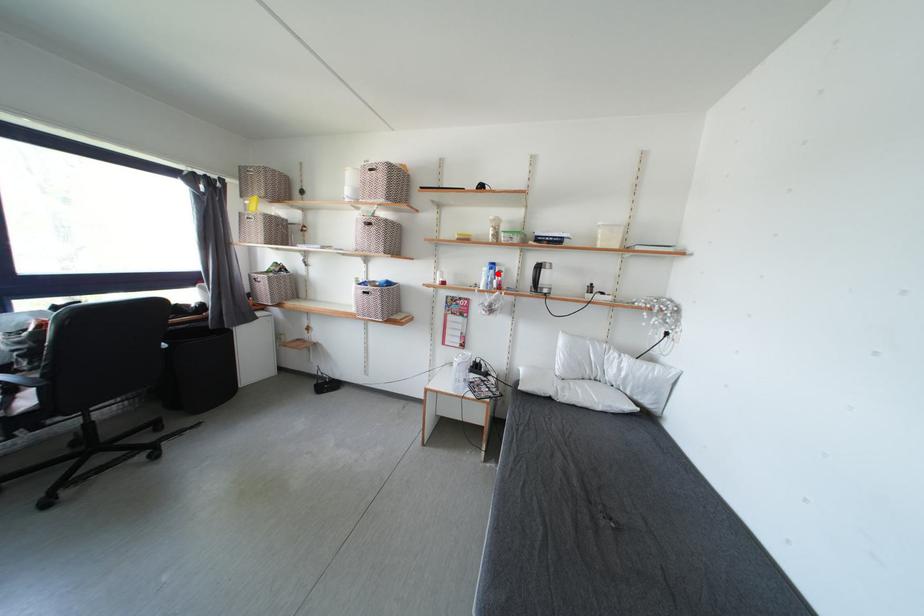
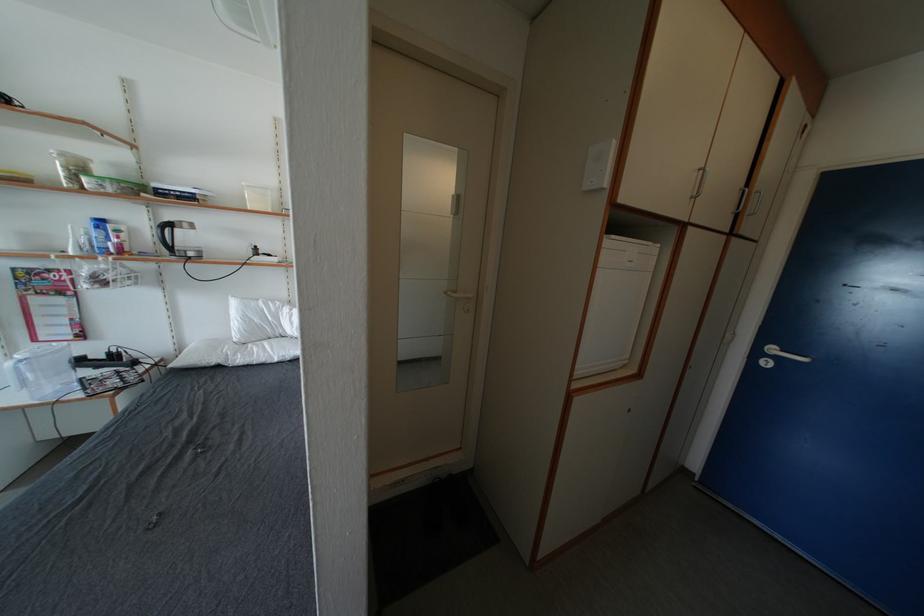
Where in the second image is the point corresponding to the highlighted location from the first image?

(103, 232)